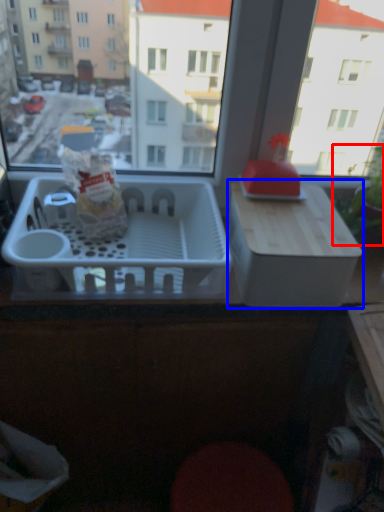
Question: Which object is closer to the camera taking this photo, plant (highlighted by a red box) or cardboard box (highlighted by a blue box)?

Choices:
 (A) plant
 (B) cardboard box

Answer: (B)